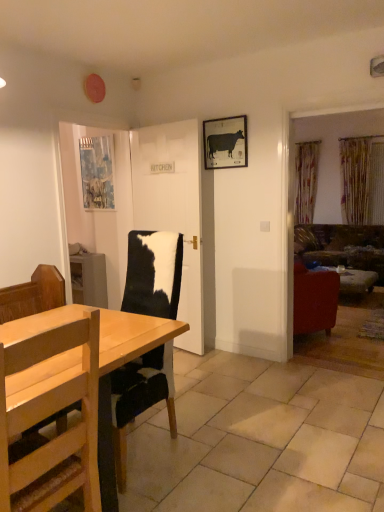
Question: Could white glossy door at center be considered to be inside velvet green sofa at right?

Choices:
 (A) yes
 (B) no

Answer: (B)

Question: Considering the relative sizes of velvet green sofa at right and white glossy door at center in the image provided, is velvet green sofa at right shorter than white glossy door at center?

Choices:
 (A) yes
 (B) no

Answer: (A)

Question: From the image's perspective, would you say velvet green sofa at right is shown under white glossy door at center?

Choices:
 (A) no
 (B) yes

Answer: (B)

Question: Is velvet green sofa at right directly adjacent to white glossy door at center?

Choices:
 (A) no
 (B) yes

Answer: (A)

Question: Is velvet green sofa at right positioned behind white glossy door at center?

Choices:
 (A) no
 (B) yes

Answer: (B)

Question: From the image's perspective, is gold textured curtain at right located above or below matte black cow at upper center, marked as the 1th picture frame in a right-to-left arrangement?

Choices:
 (A) above
 (B) below

Answer: (A)

Question: Is gold textured curtain at right to the left or to the right of matte black cow at upper center, arranged as the 2th picture frame when viewed from the back, in the image?

Choices:
 (A) left
 (B) right

Answer: (B)

Question: From a real-world perspective, is gold textured curtain at right above or below matte black cow at upper center, acting as the first picture frame starting from the front?

Choices:
 (A) above
 (B) below

Answer: (B)

Question: Considering the positions of point (382, 195) and point (223, 138), is point (382, 195) closer or farther from the camera than point (223, 138)?

Choices:
 (A) farther
 (B) closer

Answer: (A)

Question: In terms of size, does blue textured fabric at upper left, which is counted as the second picture frame, starting from the right, appear bigger or smaller than wooden table at lower right?

Choices:
 (A) big
 (B) small

Answer: (B)

Question: From a real-world perspective, is blue textured fabric at upper left, the first picture frame when ordered from left to right, above or below wooden table at lower right?

Choices:
 (A) above
 (B) below

Answer: (A)

Question: Considering the positions of blue textured fabric at upper left, positioned as the 1th picture frame in back-to-front order, and wooden table at lower right in the image, is blue textured fabric at upper left, positioned as the 1th picture frame in back-to-front order, taller or shorter than wooden table at lower right?

Choices:
 (A) tall
 (B) short

Answer: (A)

Question: Relative to wooden table at lower right, is blue textured fabric at upper left, the first picture frame when ordered from left to right, in front or behind?

Choices:
 (A) front
 (B) behind

Answer: (A)

Question: From the image's perspective, relative to blue textured fabric at upper left, which appears as the second picture frame when viewed from the front, is light wood chair at lower left above or below?

Choices:
 (A) below
 (B) above

Answer: (A)

Question: Do you think light wood chair at lower left is within blue textured fabric at upper left, the first picture frame when ordered from left to right, or outside of it?

Choices:
 (A) inside
 (B) outside

Answer: (B)